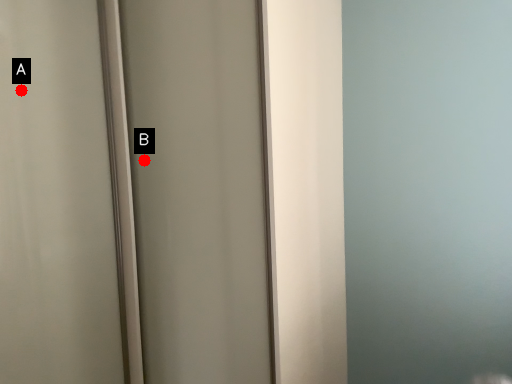
Question: Two points are circled on the image, labeled by A and B beside each circle. Which point is closer to the camera?

Choices:
 (A) A is closer
 (B) B is closer

Answer: (A)